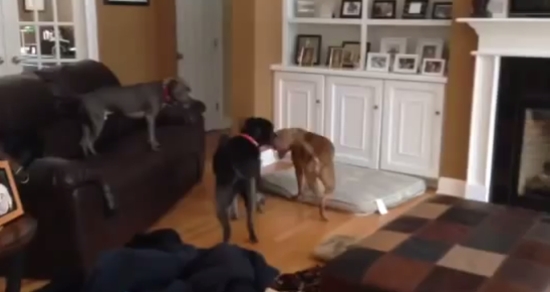
I want to click on large dog bed, so click(x=358, y=188).